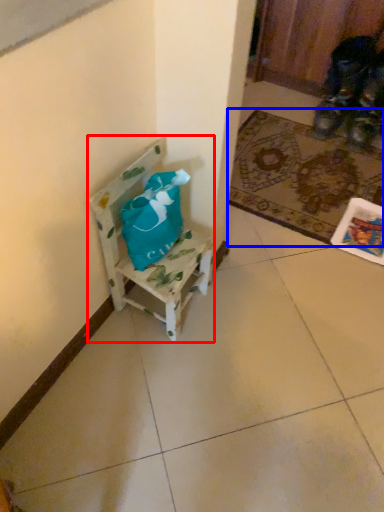
Question: Which of the following is the farthest to the observer, chair (highlighted by a red box) or mat (highlighted by a blue box)?

Choices:
 (A) chair
 (B) mat

Answer: (B)